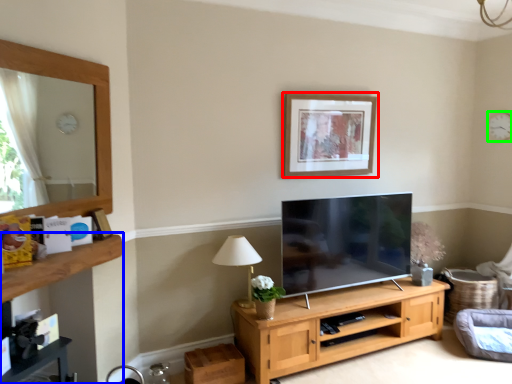
Question: Which is farther away from picture frame (highlighted by a red box)? dresser (highlighted by a blue box) or clock (highlighted by a green box)?

Choices:
 (A) dresser
 (B) clock

Answer: (A)